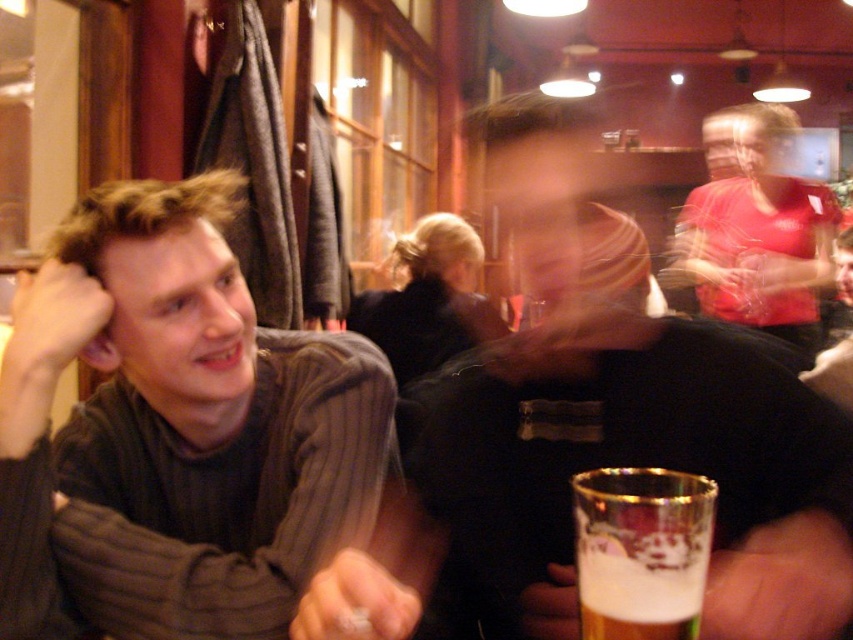
Is point (703, 362) more distant than point (820, 248)?

No, it is in front of (820, 248).

What do you see at coordinates (622, 424) in the screenshot?
I see `black matte shirt at center` at bounding box center [622, 424].

Where is `black matte shirt at center`? The image size is (853, 640). black matte shirt at center is located at coordinates (622, 424).

Who is more distant from viewer, (465, 388) or (610, 544)?

The point (465, 388) is more distant.

Is black matte shirt at center below foamy glass at lower center?

Incorrect, black matte shirt at center is not positioned below foamy glass at lower center.

Between point (747, 349) and point (585, 616), which one is positioned behind?

The point (747, 349) is more distant.

The image size is (853, 640). Find the location of `black matte shirt at center`. black matte shirt at center is located at coordinates (622, 424).

Can you confirm if matte red shirt at upper right is thinner than foamy glass at lower center?

No.

Describe the element at coordinates (755, 228) in the screenshot. I see `matte red shirt at upper right` at that location.

Identify the location of matte red shirt at upper right. (755, 228).